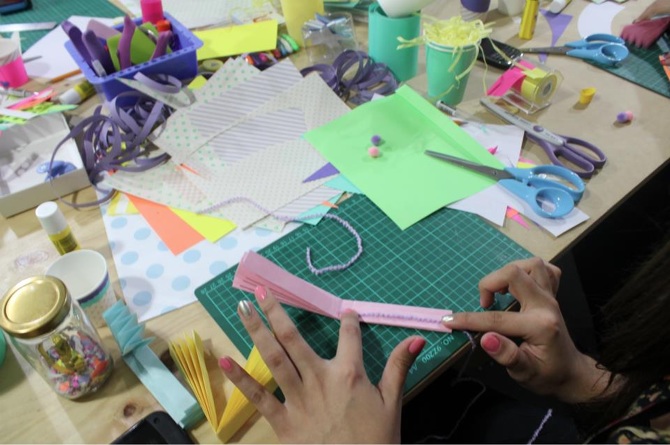
You are a GUI agent. You are given a task and a screenshot of the screen. Output one action in this format:
    pyautogui.click(x=<x>, y=<y>)
    Task: Click on the cup
    The width and height of the screenshot is (670, 445).
    Given the screenshot: What is the action you would take?
    pyautogui.click(x=443, y=65), pyautogui.click(x=445, y=46)